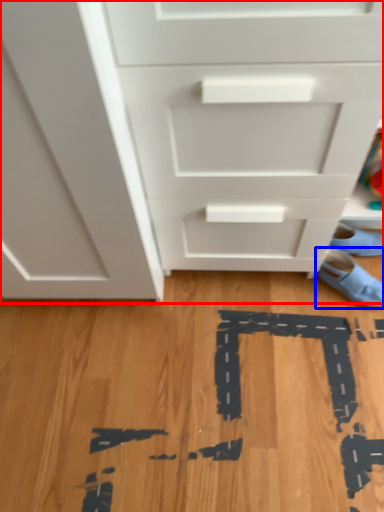
Question: Which point is further to the camera, chest of drawers (highlighted by a red box) or footwear (highlighted by a blue box)?

Choices:
 (A) chest of drawers
 (B) footwear

Answer: (B)